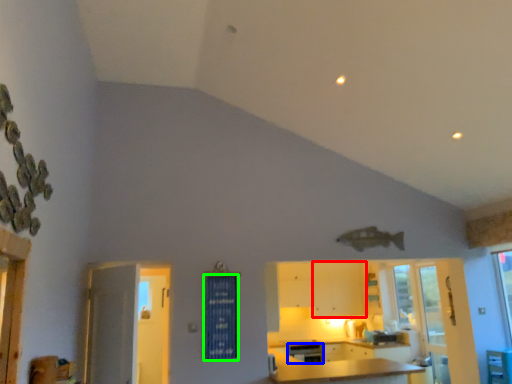
Question: Considering the real-world distances, which object is closest to cabinetry (highlighted by a red box)? dish washer (highlighted by a blue box) or curtain (highlighted by a green box).

Choices:
 (A) dish washer
 (B) curtain

Answer: (A)